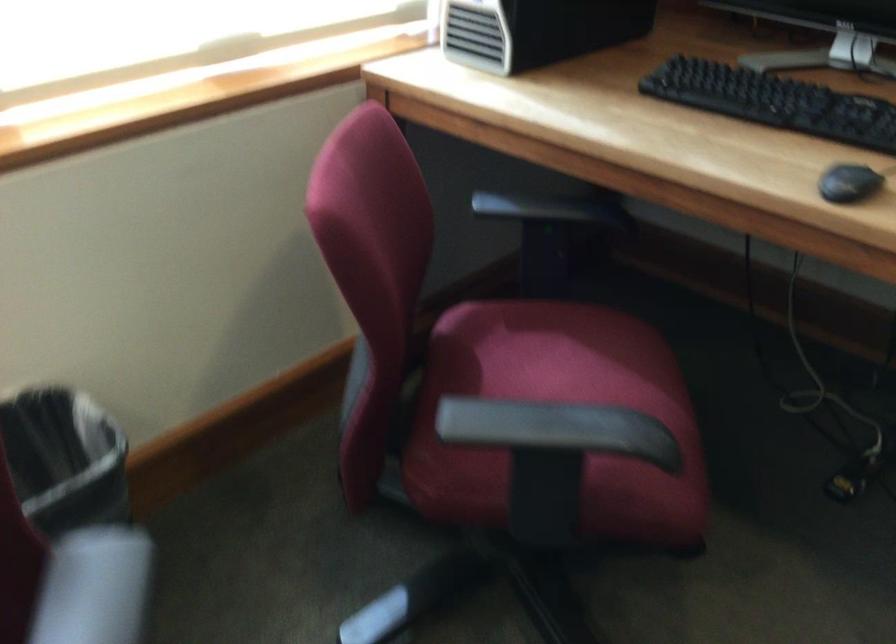
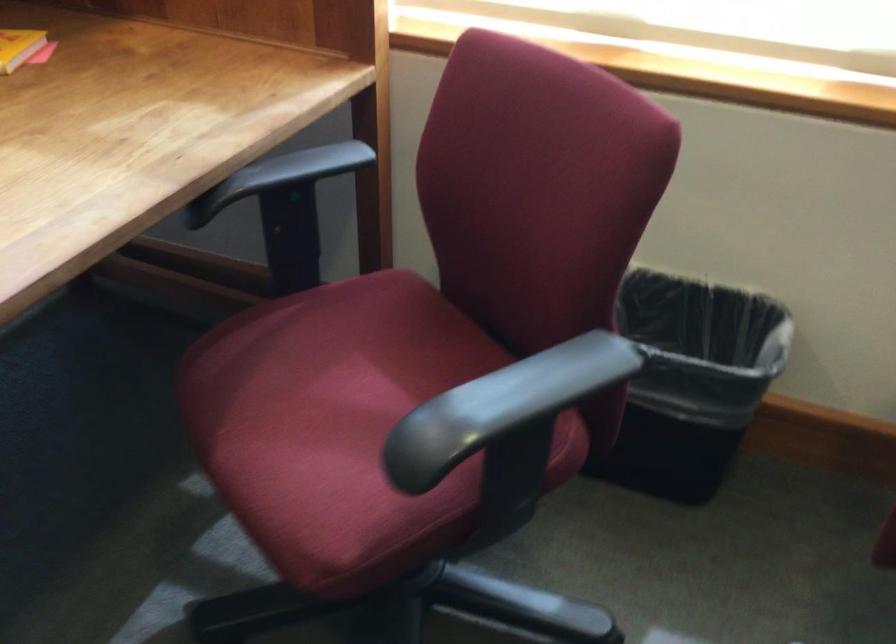
Based on the continuous images, in which direction is the camera rotating?

The camera's rotation is toward left-down.